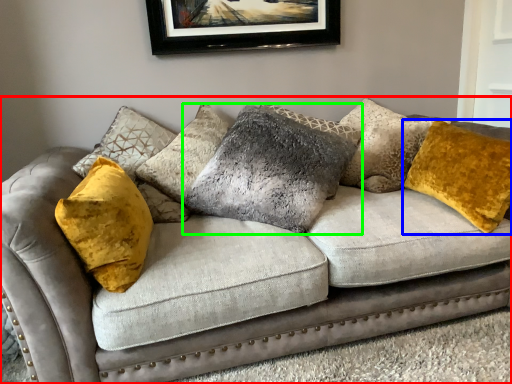
Question: Based on their relative distances, which object is nearer to studio couch (highlighted by a red box)? Choose from pillow (highlighted by a blue box) and pillow (highlighted by a green box).

Choices:
 (A) pillow
 (B) pillow

Answer: (B)